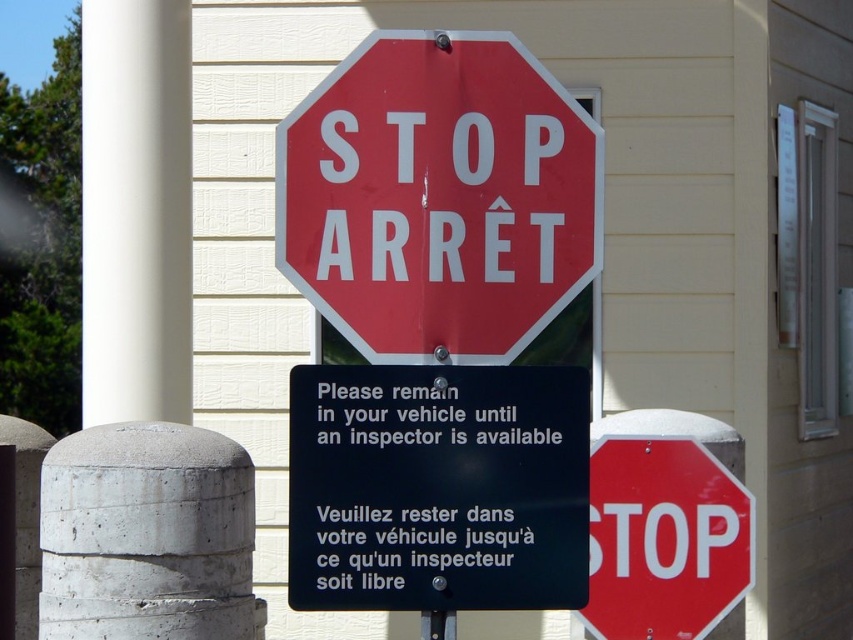
Measure the distance between point (341, 120) and camera.

Point (341, 120) and camera are 3.68 meters apart from each other.

Image resolution: width=853 pixels, height=640 pixels. What are the coordinates of `red matte stop sign at center` in the screenshot? It's located at coord(438,196).

Based on the photo, is red glossy stop sign at center positioned at the back of metallic pole at center?

Yes, it is behind metallic pole at center.

Can you confirm if red glossy stop sign at center is positioned above metallic pole at center?

Correct, red glossy stop sign at center is located above metallic pole at center.

Where is `red glossy stop sign at center`? Image resolution: width=853 pixels, height=640 pixels. red glossy stop sign at center is located at coordinates (664, 540).

What do you see at coordinates (136, 211) in the screenshot?
I see `white concrete pillar at upper left` at bounding box center [136, 211].

Measure the distance between point (x=184, y=300) and camera.

6.64 meters

Locate an element on the screen. white concrete pillar at upper left is located at coordinates (136, 211).